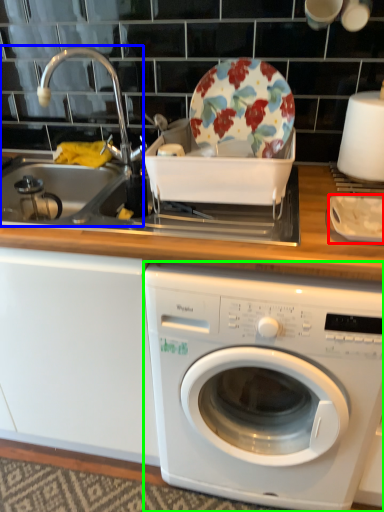
Question: Which object is positioned closest to tableware (highlighted by a red box)? Select from sink (highlighted by a blue box) and washing machine (highlighted by a green box).

Choices:
 (A) sink
 (B) washing machine

Answer: (B)